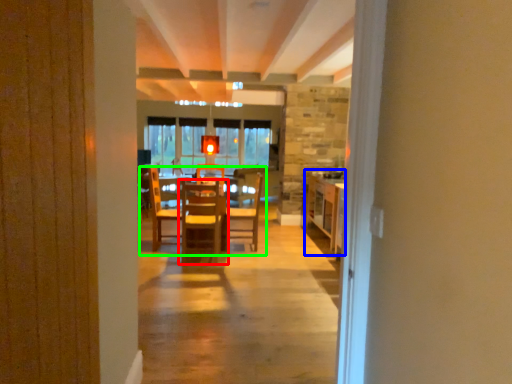
Question: Which object is positioned closest to chair (highlighted by a red box)? Select from table (highlighted by a blue box) and table (highlighted by a green box).

Choices:
 (A) table
 (B) table

Answer: (B)